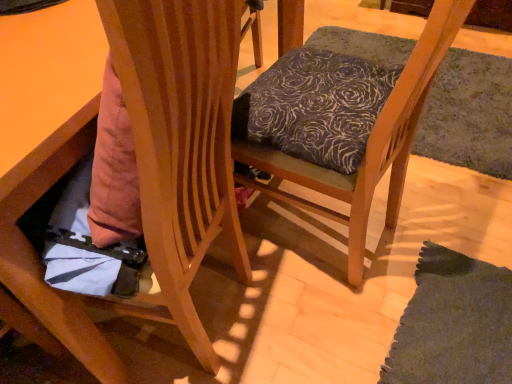
Identify the location of vacant space underneath textured fabric cushion at center, positioned as the 2th chair in left-to-right order (from a real-world perspective). This screenshot has width=512, height=384. (315, 230).